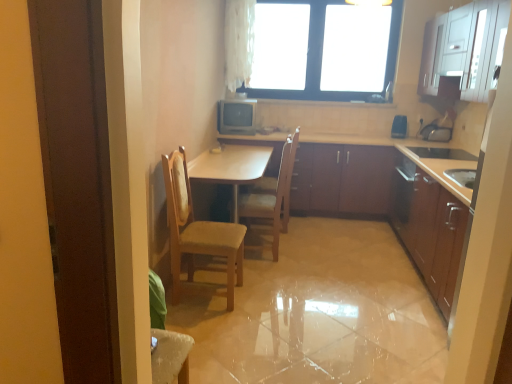
Measure the distance between point (291,39) and camera.

They are 15.44 feet apart.

Find the location of `black glass window at upper center`. black glass window at upper center is located at coordinates (323, 50).

Locate an element on the screen. light brown wood table at center is located at coordinates (231, 168).

Measure the distance between wooden at center, the 2th chair in the front-to-back sequence, and camera.

3.26 meters.

Locate an element on the screen. wooden cabinets at center, the 2th cabinetry in the bottom-to-top sequence is located at coordinates (391, 198).

The height and width of the screenshot is (384, 512). I want to click on metallic silver television at center, the 1th appliance in the left-to-right sequence, so click(236, 117).

You are a GUI agent. You are given a task and a screenshot of the screen. Output one action in this format:
    pyautogui.click(x=<x>, y=<y>)
    Task: Click on the white sheer curtain at upper center
    The width and height of the screenshot is (512, 384).
    Given the screenshot: What is the action you would take?
    pyautogui.click(x=239, y=42)

How different are the orientations of wooden cabinets at center, the 2th cabinetry in the bottom-to-top sequence, and white glossy cabinet at upper right, arranged as the fourth cabinetry when ordered from the bottom, in degrees?

The facing directions of wooden cabinets at center, the 2th cabinetry in the bottom-to-top sequence, and white glossy cabinet at upper right, arranged as the fourth cabinetry when ordered from the bottom, are 89.2 degrees apart.

Between wooden cabinets at center, acting as the third cabinetry starting from the top, and white glossy cabinet at upper right, arranged as the fourth cabinetry when ordered from the bottom, which one has smaller size?

Smaller between the two is white glossy cabinet at upper right, arranged as the fourth cabinetry when ordered from the bottom.

Where is `the 2nd cabinetry in front of the white glossy cabinet at upper right, the 1th cabinetry from the top`? Image resolution: width=512 pixels, height=384 pixels. the 2nd cabinetry in front of the white glossy cabinet at upper right, the 1th cabinetry from the top is located at coordinates (391, 198).

Consider the image. Is wooden cabinets at center, acting as the third cabinetry starting from the top, spatially inside white glossy cabinet at upper right, the 1th cabinetry from the top, or outside of it?

wooden cabinets at center, acting as the third cabinetry starting from the top, is outside white glossy cabinet at upper right, the 1th cabinetry from the top.

Could you tell me if white sheer curtain at upper center is turned towards blue plastic speaker at upper right, arranged as the 2th appliance when viewed from the left?

No.

In terms of height, does white sheer curtain at upper center look taller or shorter compared to blue plastic speaker at upper right, arranged as the 2th appliance when viewed from the left?

In the image, white sheer curtain at upper center appears to be taller than blue plastic speaker at upper right, arranged as the 2th appliance when viewed from the left.

Considering the sizes of objects white sheer curtain at upper center and blue plastic speaker at upper right, acting as the 1th appliance starting from the right, in the image provided, who is smaller, white sheer curtain at upper center or blue plastic speaker at upper right, acting as the 1th appliance starting from the right,?

With smaller size is blue plastic speaker at upper right, acting as the 1th appliance starting from the right.

The width and height of the screenshot is (512, 384). What are the coordinates of `curtain above the blue plastic speaker at upper right, acting as the 1th appliance starting from the right (from a real-world perspective)` in the screenshot? It's located at (239, 42).

Is wooden cabinets at right, the 1th cabinetry positioned from the bottom, positioned with its back to light brown wood table at center?

Absolutely, wooden cabinets at right, the 1th cabinetry positioned from the bottom, is directed away from light brown wood table at center.

Would you say wooden cabinets at right, the 1th cabinetry positioned from the bottom, is inside or outside light brown wood table at center?

wooden cabinets at right, the 1th cabinetry positioned from the bottom, lies outside light brown wood table at center.

Is wooden cabinets at right, the 1th cabinetry positioned from the bottom, taller than light brown wood table at center?

Yes, wooden cabinets at right, the 1th cabinetry positioned from the bottom, is taller than light brown wood table at center.

What's the angular difference between wooden cabinets at right, the 4th cabinetry positioned from the top, and light brown wood table at center's facing directions?

There is a 180-degree angle between the facing directions of wooden cabinets at right, the 4th cabinetry positioned from the top, and light brown wood table at center.

Considering the relative sizes of blue plastic speaker at upper right, acting as the 1th appliance starting from the right, and matte brown cabinets at center, which appears as the second cabinetry when viewed from the top, in the image provided, is blue plastic speaker at upper right, acting as the 1th appliance starting from the right, bigger than matte brown cabinets at center, which appears as the second cabinetry when viewed from the top,?

No.

Considering the relative positions of blue plastic speaker at upper right, arranged as the 2th appliance when viewed from the left, and matte brown cabinets at center, which appears as the second cabinetry when viewed from the top, in the image provided, is blue plastic speaker at upper right, arranged as the 2th appliance when viewed from the left, to the left or to the right of matte brown cabinets at center, which appears as the second cabinetry when viewed from the top,?

Based on their positions, blue plastic speaker at upper right, arranged as the 2th appliance when viewed from the left, is located to the right of matte brown cabinets at center, which appears as the second cabinetry when viewed from the top.

Is blue plastic speaker at upper right, acting as the 1th appliance starting from the right, outside of matte brown cabinets at center, placed as the third cabinetry when sorted from bottom to top?

Yes.

Identify the location of the 1st cabinetry below the blue plastic speaker at upper right, arranged as the 2th appliance when viewed from the left (from a real-world perspective). (373, 175).

Is white sheer curtain at upper center taller or shorter than matte brown cabinets at center, placed as the third cabinetry when sorted from bottom to top?

Considering their sizes, white sheer curtain at upper center has more height than matte brown cabinets at center, placed as the third cabinetry when sorted from bottom to top.

Considering the positions of objects white sheer curtain at upper center and matte brown cabinets at center, which appears as the second cabinetry when viewed from the top, in the image provided, who is more to the right, white sheer curtain at upper center or matte brown cabinets at center, which appears as the second cabinetry when viewed from the top,?

matte brown cabinets at center, which appears as the second cabinetry when viewed from the top, is more to the right.

I want to click on curtain to the left of matte brown cabinets at center, which appears as the second cabinetry when viewed from the top, so click(x=239, y=42).

Is the depth of white sheer curtain at upper center greater than that of matte brown cabinets at center, which appears as the second cabinetry when viewed from the top?

No, it is in front of matte brown cabinets at center, which appears as the second cabinetry when viewed from the top.

Locate an element on the screen. Image resolution: width=512 pixels, height=384 pixels. window above the matte brown cabinets at center, which appears as the second cabinetry when viewed from the top (from a real-world perspective) is located at coordinates (323, 50).

What's the angular difference between matte brown cabinets at center, which appears as the second cabinetry when viewed from the top, and black glass window at upper center's facing directions?

0.375 degrees.

Which is behind, matte brown cabinets at center, placed as the third cabinetry when sorted from bottom to top, or black glass window at upper center?

black glass window at upper center.

Consider the image. Looking at their sizes, would you say matte brown cabinets at center, placed as the third cabinetry when sorted from bottom to top, is wider or thinner than black glass window at upper center?

matte brown cabinets at center, placed as the third cabinetry when sorted from bottom to top, is wider than black glass window at upper center.

From the matte brown cabinets at center, placed as the third cabinetry when sorted from bottom to top, count 2nd cabinetrys forward and point to it. Please provide its 2D coordinates.

[(429, 227)]

Would you say matte brown cabinets at center, which appears as the second cabinetry when viewed from the top, is part of wooden cabinets at right, the 4th cabinetry positioned from the top,'s contents?

No, matte brown cabinets at center, which appears as the second cabinetry when viewed from the top, is not surrounded by wooden cabinets at right, the 4th cabinetry positioned from the top.

Which object is further away from the camera taking this photo, wooden cabinets at right, the 4th cabinetry positioned from the top, or matte brown cabinets at center, which appears as the second cabinetry when viewed from the top?

Positioned behind is matte brown cabinets at center, which appears as the second cabinetry when viewed from the top.

Between wooden cabinets at right, the 1th cabinetry positioned from the bottom, and matte brown cabinets at center, placed as the third cabinetry when sorted from bottom to top, which one has larger size?

wooden cabinets at right, the 1th cabinetry positioned from the bottom.

Where is `the 2nd cabinetry to the left of the white glossy cabinet at upper right, arranged as the fourth cabinetry when ordered from the bottom, counting from the anchor's position`? The image size is (512, 384). the 2nd cabinetry to the left of the white glossy cabinet at upper right, arranged as the fourth cabinetry when ordered from the bottom, counting from the anchor's position is located at coordinates (391, 198).

Find the location of a particular element. The height and width of the screenshot is (384, 512). curtain lying in front of the blue plastic speaker at upper right, acting as the 1th appliance starting from the right is located at coordinates (239, 42).

From the image, which object appears to be farther from metallic silver television at center, the second appliance in the right-to-left sequence, matte brown cabinets at center, which appears as the second cabinetry when viewed from the top, or light brown wood table at center?

matte brown cabinets at center, which appears as the second cabinetry when viewed from the top, lies further to metallic silver television at center, the second appliance in the right-to-left sequence, than the other object.

Which object lies nearer to the anchor point wooden cabinets at center, acting as the third cabinetry starting from the top, light brown wood table at center or wooden at center, marked as the 1th chair in a back-to-front arrangement?

light brown wood table at center is positioned closer to the anchor wooden cabinets at center, acting as the third cabinetry starting from the top.

From the image, which object appears to be farther from wooden at center, marked as the 1th chair in a back-to-front arrangement, light brown wood table at center or wooden chair at center, arranged as the second chair when viewed from the back?

Among the two, wooden chair at center, arranged as the second chair when viewed from the back, is located further to wooden at center, marked as the 1th chair in a back-to-front arrangement.

From the picture: Considering their positions, is wooden chair at center, arranged as the second chair when viewed from the back, positioned closer to white sheer curtain at upper center than blue plastic speaker at upper right, acting as the 1th appliance starting from the right?

blue plastic speaker at upper right, acting as the 1th appliance starting from the right.

Looking at the image, which one is located further to white sheer curtain at upper center, matte brown cabinets at center, placed as the third cabinetry when sorted from bottom to top, or wooden cabinets at right, the 4th cabinetry positioned from the top?

Based on the image, wooden cabinets at right, the 4th cabinetry positioned from the top, appears to be further to white sheer curtain at upper center.

Looking at the image, which one is located further to black glass window at upper center, wooden cabinets at right, the 1th cabinetry positioned from the bottom, or metallic silver television at center, the 1th appliance in the left-to-right sequence?

The object further to black glass window at upper center is wooden cabinets at right, the 1th cabinetry positioned from the bottom.

Looking at the image, which one is located closer to wooden chair at center, arranged as the second chair when viewed from the back, white sheer curtain at upper center or white glossy cabinet at upper right, arranged as the fourth cabinetry when ordered from the bottom?

white glossy cabinet at upper right, arranged as the fourth cabinetry when ordered from the bottom, is closer to wooden chair at center, arranged as the second chair when viewed from the back.

When comparing their distances from light brown wood table at center, does matte brown cabinets at center, placed as the third cabinetry when sorted from bottom to top, or black glass window at upper center seem closer?

matte brown cabinets at center, placed as the third cabinetry when sorted from bottom to top, is closer to light brown wood table at center.

The height and width of the screenshot is (384, 512). I want to click on table between wooden cabinets at center, the 2th cabinetry in the bottom-to-top sequence, and matte brown cabinets at center, placed as the third cabinetry when sorted from bottom to top, from front to back, so click(x=231, y=168).

This screenshot has height=384, width=512. I want to click on table between wooden cabinets at center, the 2th cabinetry in the bottom-to-top sequence, and blue plastic speaker at upper right, acting as the 1th appliance starting from the right, along the z-axis, so click(231, 168).

This screenshot has height=384, width=512. Identify the location of curtain between black glass window at upper center and matte brown cabinets at center, which appears as the second cabinetry when viewed from the top, vertically. (239, 42).

The width and height of the screenshot is (512, 384). I want to click on chair between wooden chair at center, arranged as the second chair when viewed from the back, and metallic silver television at center, the second appliance in the right-to-left sequence, from front to back, so click(272, 195).